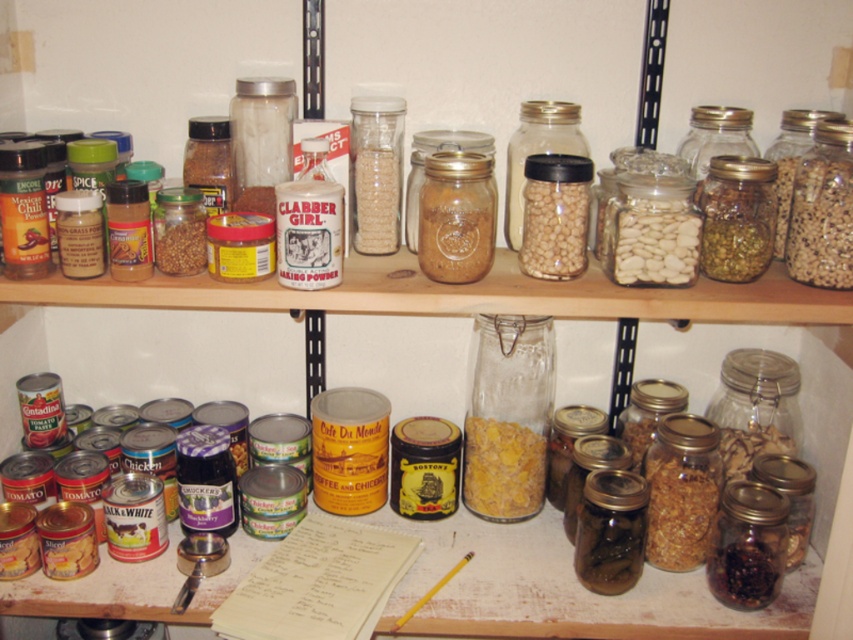
Question: Does yellow matte corn at center have a lesser width compared to brown granular at lower right?

Choices:
 (A) no
 (B) yes

Answer: (A)

Question: In this image, where is clear glass jar at center located relative to brown granular at lower right?

Choices:
 (A) below
 (B) above

Answer: (B)

Question: From the image, what is the correct spatial relationship of brown granular at lower right in relation to translucent glass jar at center?

Choices:
 (A) right
 (B) left

Answer: (A)

Question: Which point is closer to the camera?

Choices:
 (A) (514, 436)
 (B) (479, 508)
 (C) (648, 272)
 (D) (524, 266)

Answer: (C)

Question: Which point is closer to the camera?

Choices:
 (A) (538, 346)
 (B) (550, 200)
 (C) (532, 509)
 (D) (645, 246)

Answer: (D)

Question: Which is farther from the translucent glass jar at center?

Choices:
 (A) brown granular at lower right
 (B) yellow matte corn at center
 (C) clear glass jar at center

Answer: (A)